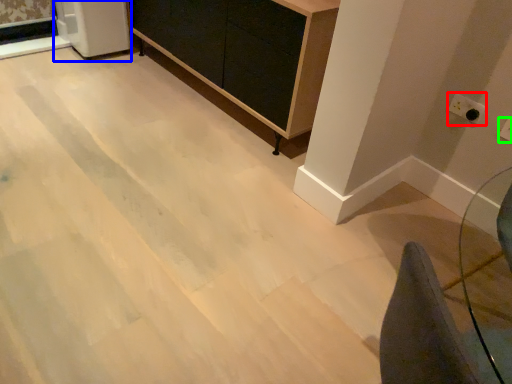
Question: Considering the real-world distances, which object is closest to electric outlet (highlighted by a red box)? appliance (highlighted by a blue box) or electric outlet (highlighted by a green box).

Choices:
 (A) appliance
 (B) electric outlet

Answer: (B)